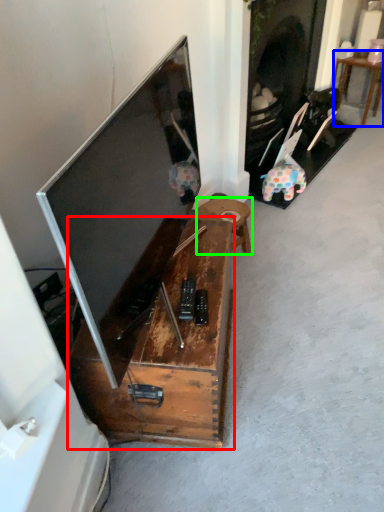
Question: Estimate the real-world distances between objects in this image. Which object is farther from furniture (highlighted by a red box), table (highlighted by a blue box) or table (highlighted by a green box)?

Choices:
 (A) table
 (B) table

Answer: (A)